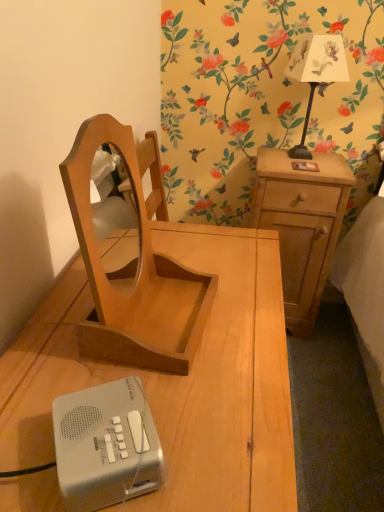
Locate an element on the screen. free space in front of white paper lampshade at upper right is located at coordinates (306, 174).